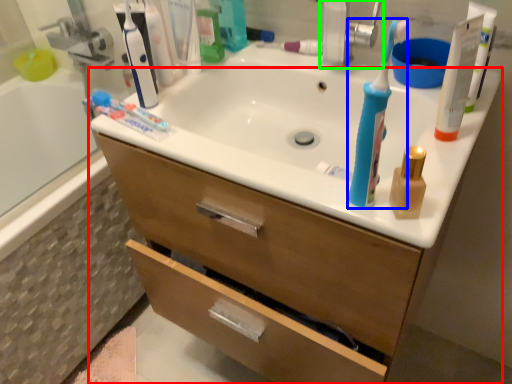
Question: Which is farther away from bathroom cabinet (highlighted by a red box)? toothbrush (highlighted by a blue box) or faucet (highlighted by a green box)?

Choices:
 (A) toothbrush
 (B) faucet

Answer: (B)